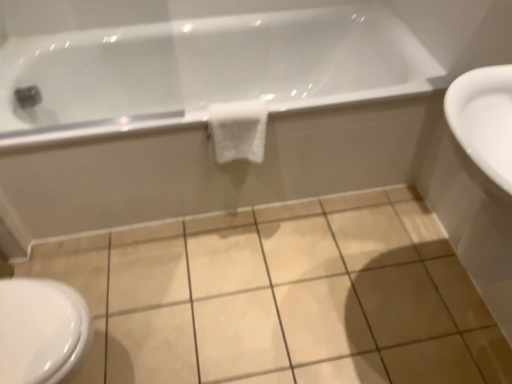
Where is `vacant point above beige ceramic tile at center (from a real-world perspective)`? The height and width of the screenshot is (384, 512). vacant point above beige ceramic tile at center (from a real-world perspective) is located at coordinates (248, 282).